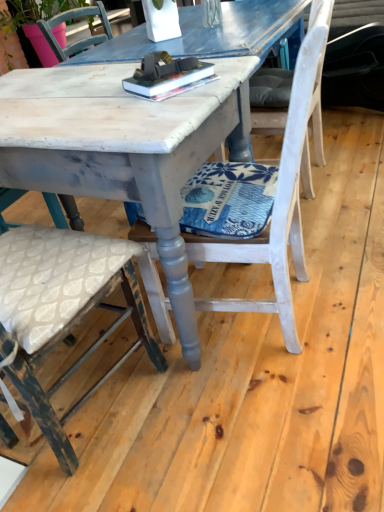
Question: From a real-world perspective, is hardcover book at center physically located above or below distressed white wood table at center?

Choices:
 (A) below
 (B) above

Answer: (B)

Question: Based on their positions, is hardcover book at center located to the left or right of distressed white wood table at center?

Choices:
 (A) right
 (B) left

Answer: (A)

Question: Which is farther from the matte pink pot at upper left?

Choices:
 (A) distressed white chair at center, the first chair from the left
 (B) distressed white wood table at center
 (C) hardcover book at center
 (D) white painted wood chair at center, arranged as the 2th chair when viewed from the left
 (E) white painted wood chair at center, arranged as the third chair when viewed from the left

Answer: (A)

Question: Estimate the real-world distances between objects in this image. Which object is closer to the matte pink pot at upper left?

Choices:
 (A) white painted wood chair at center, the 1th chair in the right-to-left sequence
 (B) white painted wood chair at center, which appears as the second chair when viewed from the right
 (C) distressed white chair at center, which ranks as the third chair in right-to-left order
 (D) distressed white wood table at center
 (E) hardcover book at center

Answer: (D)